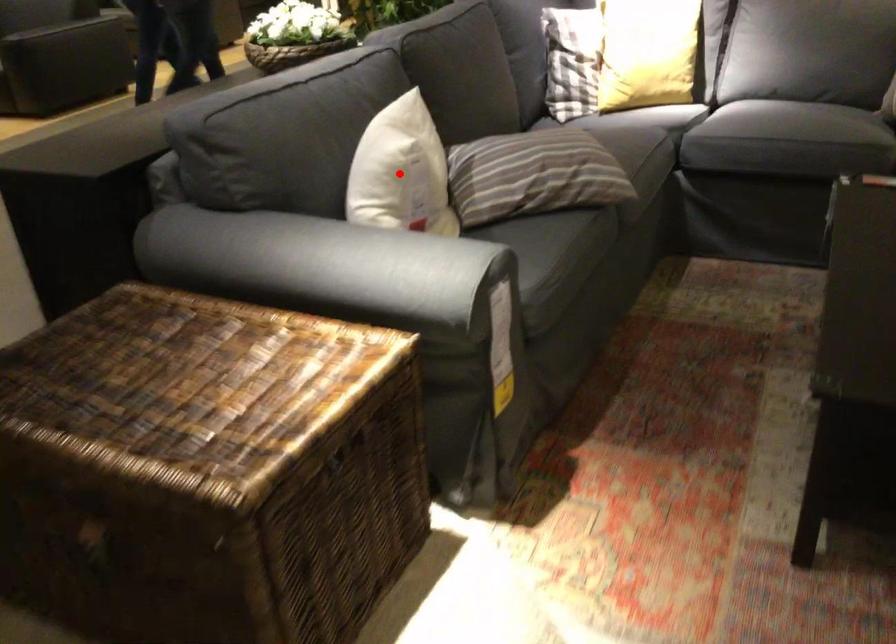
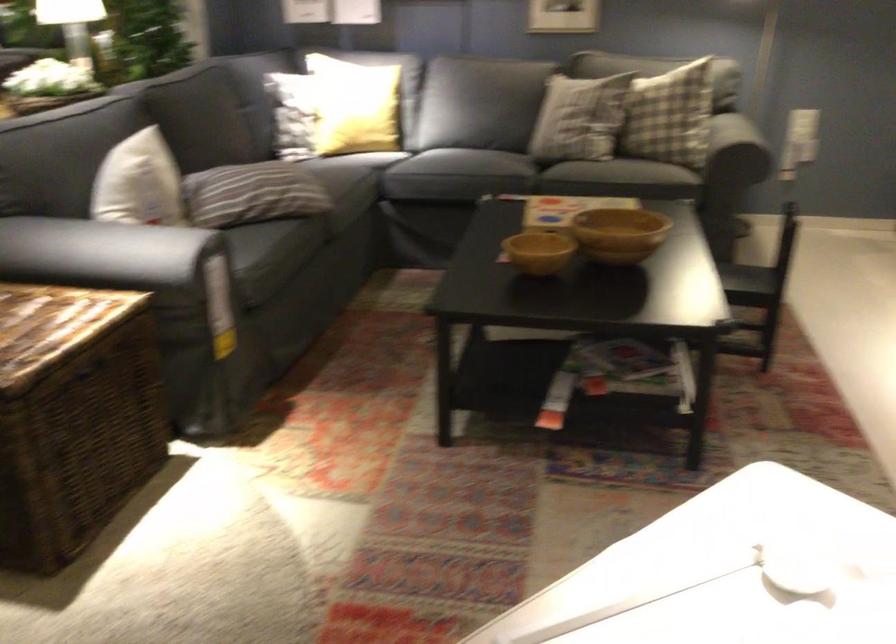
In the second image, find the point that corresponds to the highlighted location in the first image.

(139, 183)